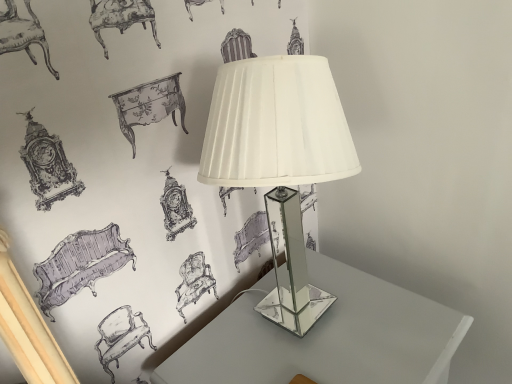
Question: Is clear glass table at center in front of or behind clear glass lamp at center in the image?

Choices:
 (A) behind
 (B) front

Answer: (A)

Question: Considering the positions of clear glass table at center and clear glass lamp at center in the image, is clear glass table at center taller or shorter than clear glass lamp at center?

Choices:
 (A) short
 (B) tall

Answer: (B)

Question: Is point (425, 299) closer or farther from the camera than point (298, 59)?

Choices:
 (A) closer
 (B) farther

Answer: (B)

Question: In the image, is clear glass lamp at center positioned in front of or behind clear glass table at center?

Choices:
 (A) behind
 (B) front

Answer: (B)

Question: Considering the positions of point (259, 110) and point (196, 377), is point (259, 110) closer or farther from the camera than point (196, 377)?

Choices:
 (A) farther
 (B) closer

Answer: (B)

Question: Is clear glass lamp at center inside the boundaries of clear glass table at center, or outside?

Choices:
 (A) inside
 (B) outside

Answer: (B)

Question: Considering the positions of clear glass lamp at center and clear glass table at center in the image, is clear glass lamp at center taller or shorter than clear glass table at center?

Choices:
 (A) short
 (B) tall

Answer: (A)